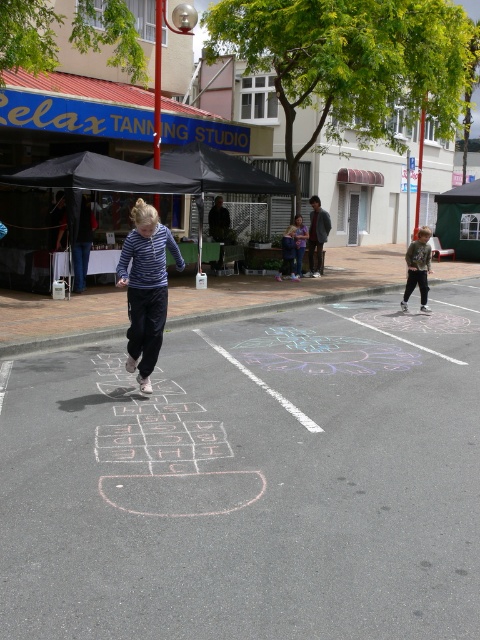
You are standing at the point labeled point (420, 253) and want to take a photo of the lively street scene. If your camera can focus on objects up to 15 meters away, will it be able to capture the scene clearly?

The point labeled point (420, 253) and the camera are 13.37 meters apart. Since the camera can focus up to 15 meters, it will be able to capture the scene clearly as the distance is within range.

You are a parent trying to take a photo of your child playing hopscotch. You are standing at the edge of the street. To ensure both the white chalk hopscotch at center and the camouflage jacket at right are fully visible in the frame, which object should you position closer to the camera?

You should position the white chalk hopscotch at center closer to the camera because it is taller than the camouflage jacket at right, ensuring both fit within the frame.